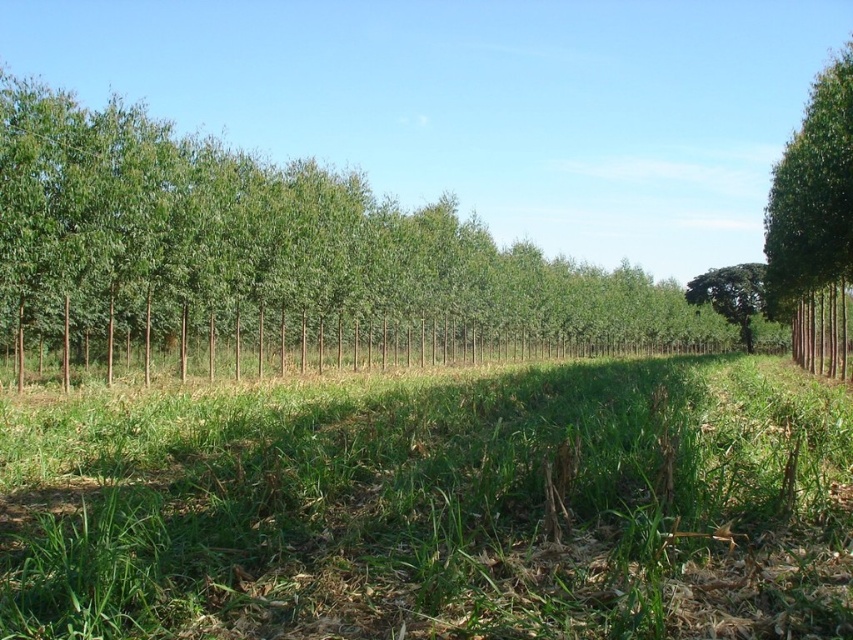
Question: Does green leafy tree at center appear under green leafy tree at center-right?

Choices:
 (A) yes
 (B) no

Answer: (B)

Question: Which is farther from the green leafy tree at center?

Choices:
 (A) green leafy tree at right
 (B) green grass at center
 (C) green leafy tree at center-right

Answer: (A)

Question: In this image, where is green leafy tree at center located relative to green leafy tree at center-right?

Choices:
 (A) above
 (B) below

Answer: (A)

Question: Is green leafy tree at center below green leafy tree at center-right?

Choices:
 (A) yes
 (B) no

Answer: (B)

Question: Based on their relative distances, which object is nearer to the green leafy tree at right?

Choices:
 (A) green leafy tree at center-right
 (B) green leafy tree at center
 (C) green grass at center

Answer: (C)

Question: Among these points, which one is farthest from the camera?

Choices:
 (A) (747, 266)
 (B) (109, 205)

Answer: (A)